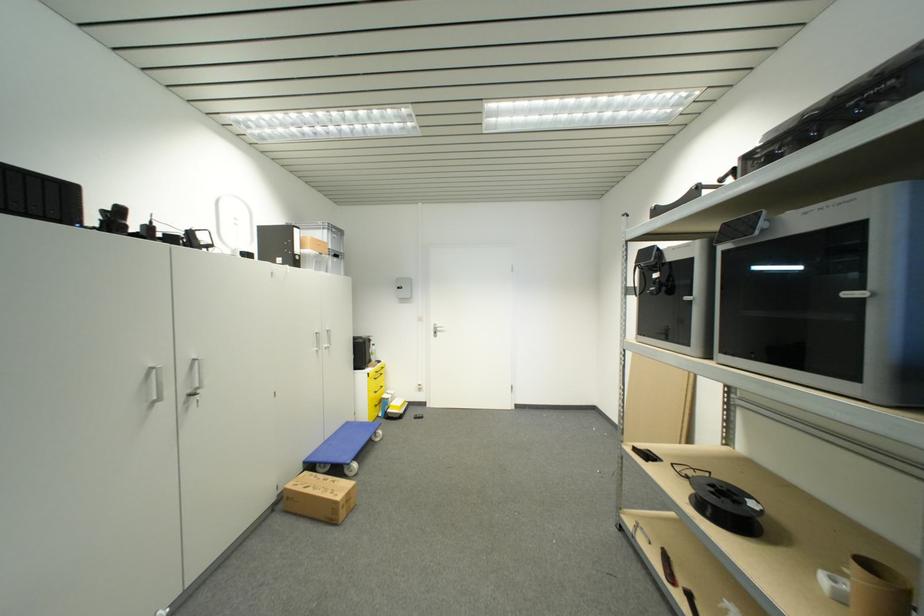
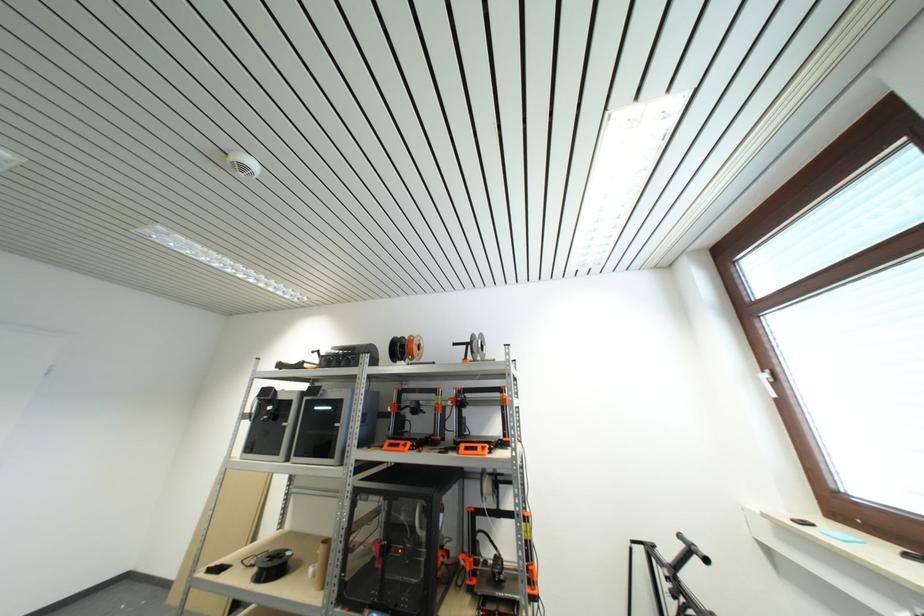
Where in the second image is the point corresponding to the point at 853,297 from the first image?

(341, 427)